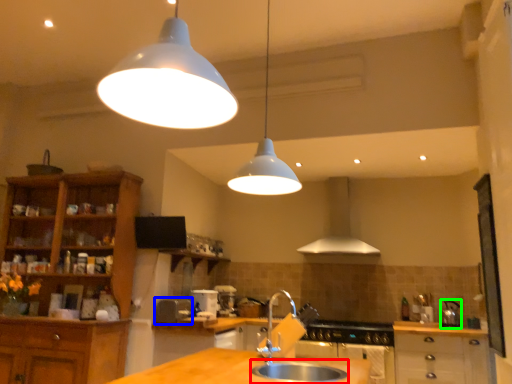
Question: Which object is positioned closest to sink (highlighted by a red box)? Select from appliance (highlighted by a blue box) and appliance (highlighted by a green box).

Choices:
 (A) appliance
 (B) appliance

Answer: (A)